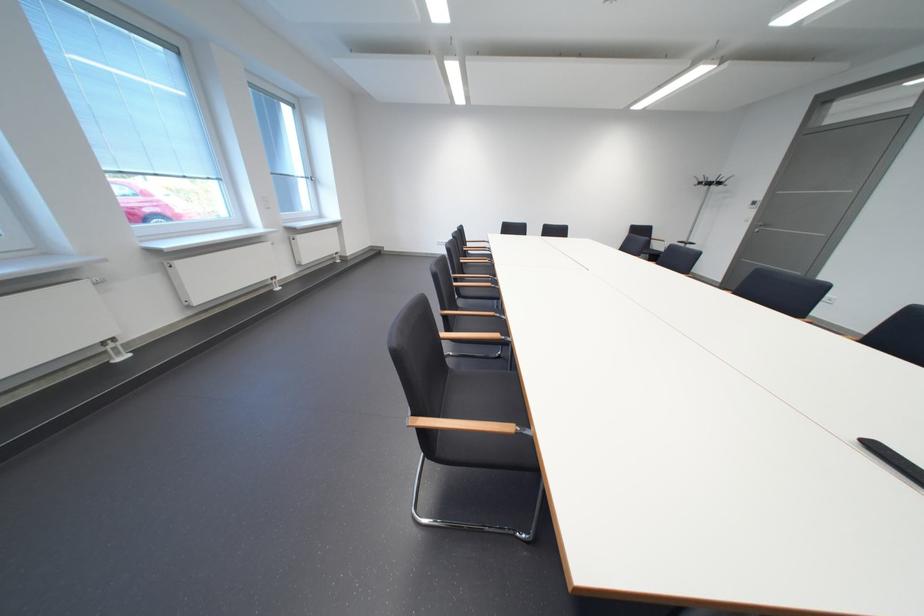
At what (x,y) coordinates should I click in order to perform the action: click on black chair sitting surface. Please return your answer as a coordinate pair (x, y). Looking at the image, I should click on (483, 397).